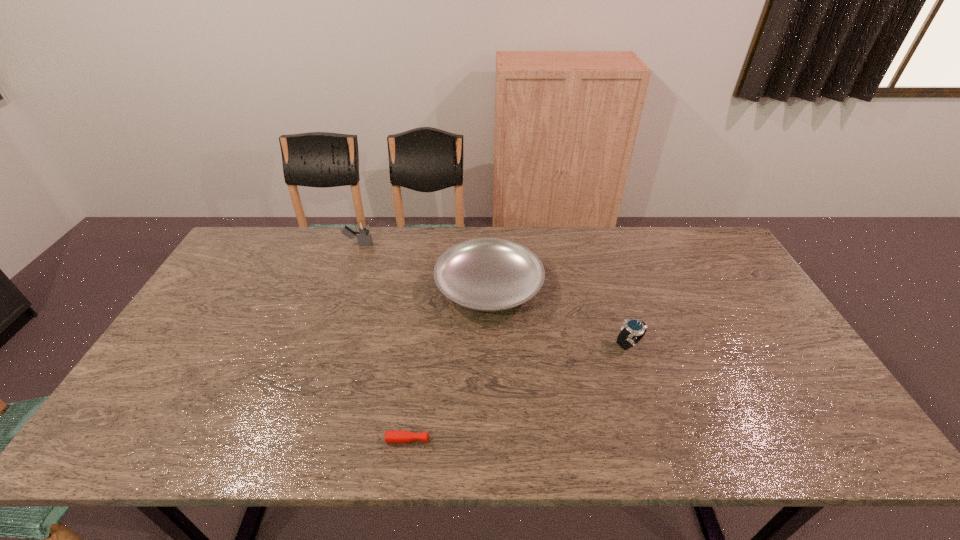
I want to click on vacant area in the image that satisfies the following two spatial constraints: 1. on the front side of the rightmost object; 2. at the tip of the screwdriver, so click(x=660, y=440).